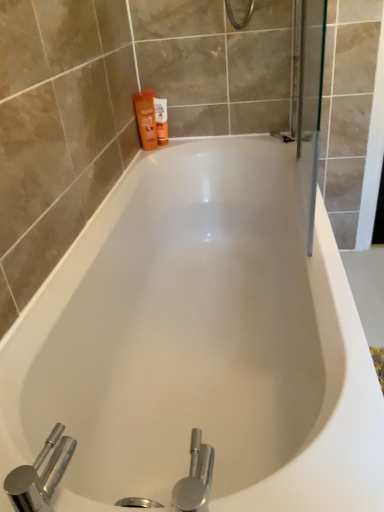
Question: Is white glossy bathtub at center in front of or behind chrome metallic faucet at lower left in the image?

Choices:
 (A) front
 (B) behind

Answer: (B)

Question: From a real-world perspective, is white glossy bathtub at center positioned above or below chrome metallic faucet at lower left?

Choices:
 (A) below
 (B) above

Answer: (A)

Question: Which object is the closest to the orange matte bottle at upper left, placed as the 1th toiletry when sorted from left to right?

Choices:
 (A) white glossy bathtub at center
 (B) orange matte lotion at upper left, which is the first toiletry from right to left
 (C) chrome metallic faucet at lower left

Answer: (B)

Question: Considering the real-world distances, which object is closest to the chrome metallic faucet at lower left?

Choices:
 (A) orange matte lotion at upper left, which ranks as the second toiletry in left-to-right order
 (B) orange matte bottle at upper left, which is the 2th toiletry in right-to-left order
 (C) white glossy bathtub at center

Answer: (C)